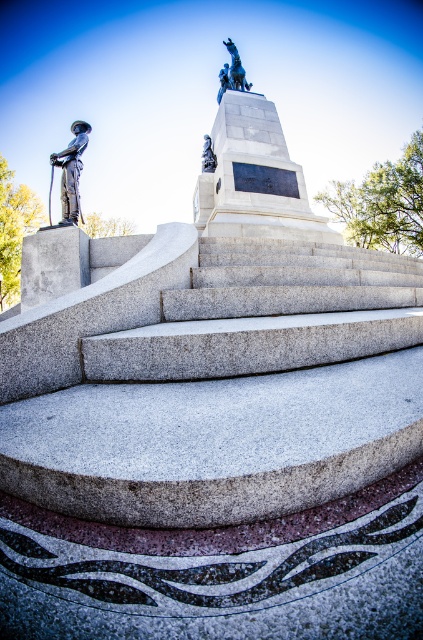
Is polished bronze horse at upper center to the left of blue polished stone statue at center from the viewer's perspective?

In fact, polished bronze horse at upper center is to the right of blue polished stone statue at center.

Which is in front, point (233, 72) or point (211, 163)?

Point (211, 163) is in front.

What do you see at coordinates (231, 72) in the screenshot? I see `polished bronze horse at upper center` at bounding box center [231, 72].

Locate an element on the screen. The image size is (423, 640). polished bronze horse at upper center is located at coordinates (231, 72).

Is point (65, 172) positioned before point (214, 166)?

That is True.

Between bronze statue at left and blue polished stone statue at center, which one has more height?

With more height is bronze statue at left.

Is point (79, 125) positioned behind point (214, 168)?

No, it is in front of (214, 168).

Identify the location of bronze statue at left. This screenshot has width=423, height=640. (71, 172).

Is bronze statue at left bigger than polished bronze horse at upper center?

Actually, bronze statue at left might be smaller than polished bronze horse at upper center.

Describe the element at coordinates (71, 172) in the screenshot. This screenshot has width=423, height=640. I see `bronze statue at left` at that location.

Does point (84, 125) come in front of point (222, 76)?

Yes.

This screenshot has height=640, width=423. Find the location of `bronze statue at left`. bronze statue at left is located at coordinates (71, 172).